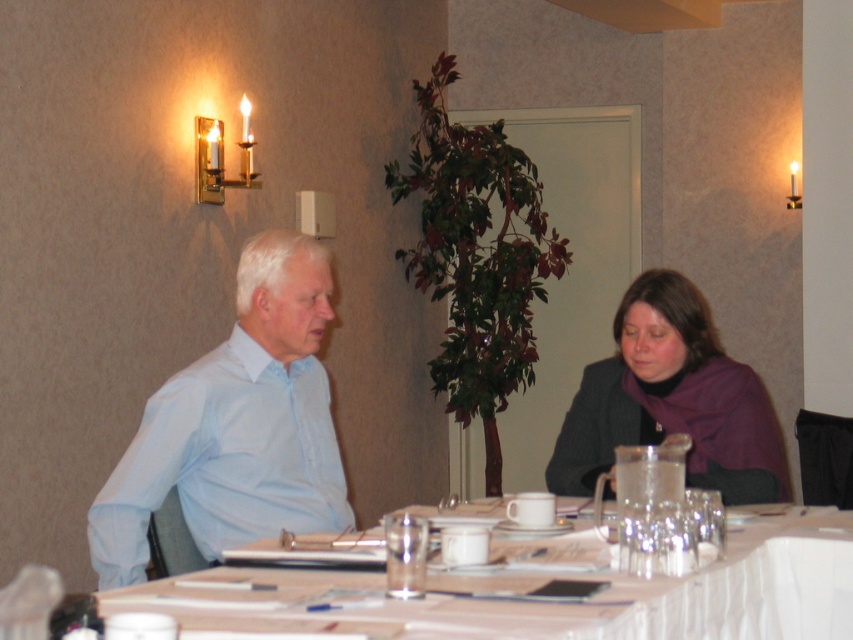
Which of these two, light blue shirt at center or purple wool scarf at lower right, stands shorter?

Standing shorter between the two is purple wool scarf at lower right.

Does light blue shirt at center have a greater width compared to purple wool scarf at lower right?

No.

This screenshot has height=640, width=853. Describe the element at coordinates (236, 426) in the screenshot. I see `light blue shirt at center` at that location.

At what (x,y) coordinates should I click in order to perform the action: click on light blue shirt at center. Please return your answer as a coordinate pair (x, y). Looking at the image, I should click on (236, 426).

Does light blue shirt at left appear on the right side of light blue shirt at center?

Indeed, light blue shirt at left is positioned on the right side of light blue shirt at center.

Is point (221, 452) in front of point (329, 298)?

Yes, point (221, 452) is in front of point (329, 298).

Image resolution: width=853 pixels, height=640 pixels. I want to click on light blue shirt at left, so click(x=236, y=426).

Does point (801, 580) come in front of point (321, 442)?

Yes, point (801, 580) is closer to viewer.

Is point (293, 584) positioned after point (321, 401)?

No, (293, 584) is in front of (321, 401).

Describe the element at coordinates (543, 602) in the screenshot. I see `white glossy table at center` at that location.

I want to click on white glossy table at center, so click(543, 602).